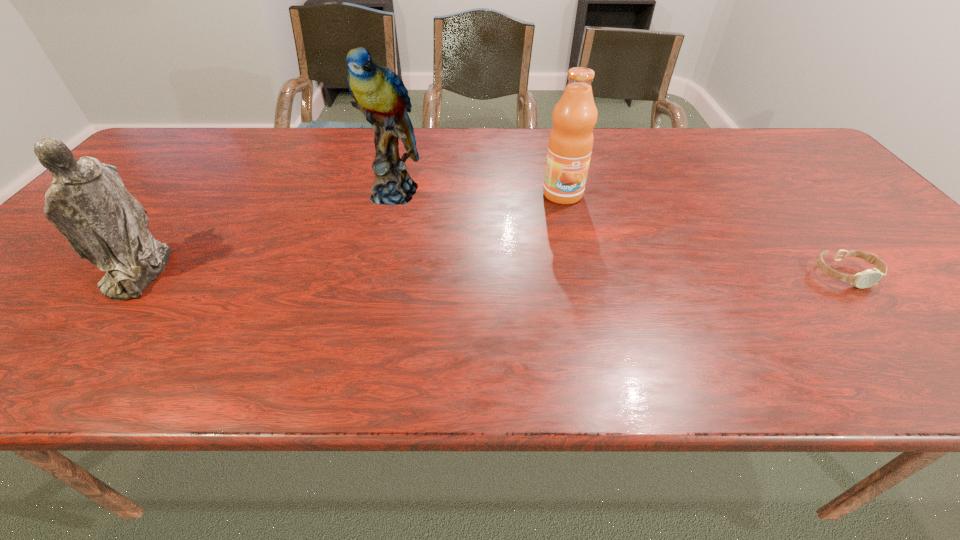
At what (x,y) coordinates should I click in order to perform the action: click on free space on the desktop that is between the leftmost object and the shortest object and is positioned on the face of the tallest object. Please return your answer as a coordinate pair (x, y). Looking at the image, I should click on (389, 273).

Locate an element on the screen. The height and width of the screenshot is (540, 960). free spot on the desktop that is between the leftmost object and the rightmost object and is positioned on the label side of the second object from right to left is located at coordinates (592, 273).